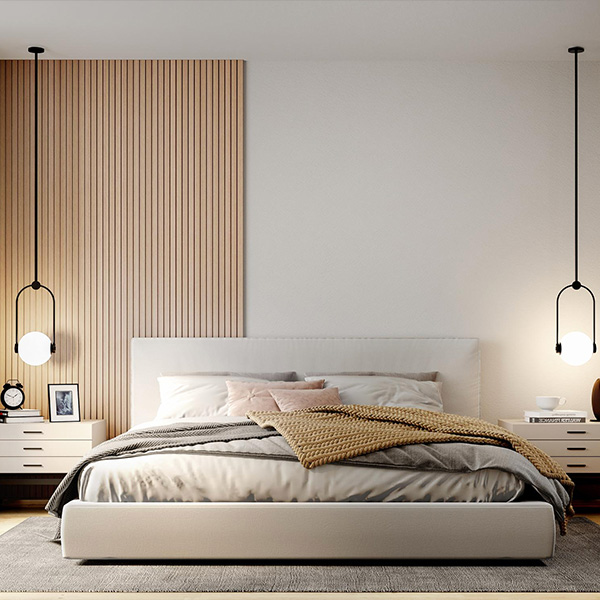
This screenshot has width=600, height=600. I want to click on drawers, so click(61, 433), click(61, 447), click(59, 465), click(539, 432), click(552, 450), click(596, 465).